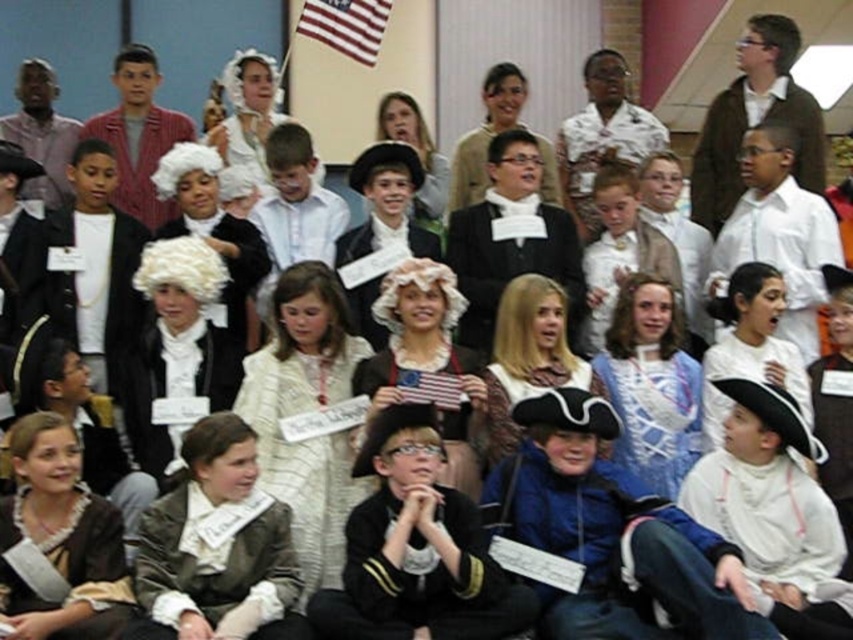
Measure the distance between matte brown jacket at center and white textured dress at center.

A distance of 13.44 feet exists between matte brown jacket at center and white textured dress at center.

Which is above, matte brown jacket at center or white textured dress at center?

white textured dress at center is higher up.

Is point (283, 524) closer to camera compared to point (358, 360)?

Yes, it is in front of point (358, 360).

Identify the location of matte brown jacket at center. The height and width of the screenshot is (640, 853). (218, 547).

Does point (198, 637) lie behind point (405, 397)?

No.

Locate an element on the screen. matte brown jacket at center is located at coordinates (218, 547).

Image resolution: width=853 pixels, height=640 pixels. What are the coordinates of `matte brown jacket at center` in the screenshot? It's located at (218, 547).

Locate an element on the screen. white textured dress at center is located at coordinates point(305,449).

Does white textured dress at center have a larger size compared to american flag at center?

Indeed, white textured dress at center has a larger size compared to american flag at center.

What do you see at coordinates (305, 449) in the screenshot? This screenshot has height=640, width=853. I see `white textured dress at center` at bounding box center [305, 449].

Identify the location of white textured dress at center. (305, 449).